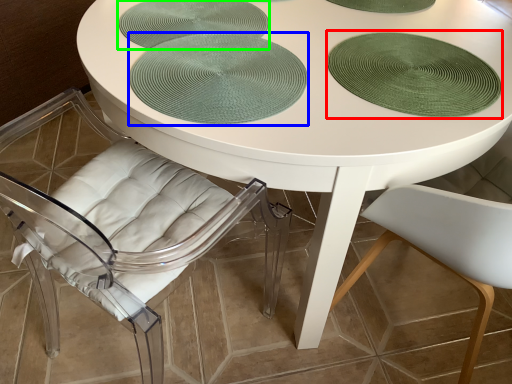
Question: Which object is positioned farthest from glass plate (highlighted by a red box)? Select from poker table (highlighted by a blue box) and glass plate (highlighted by a green box).

Choices:
 (A) poker table
 (B) glass plate

Answer: (B)